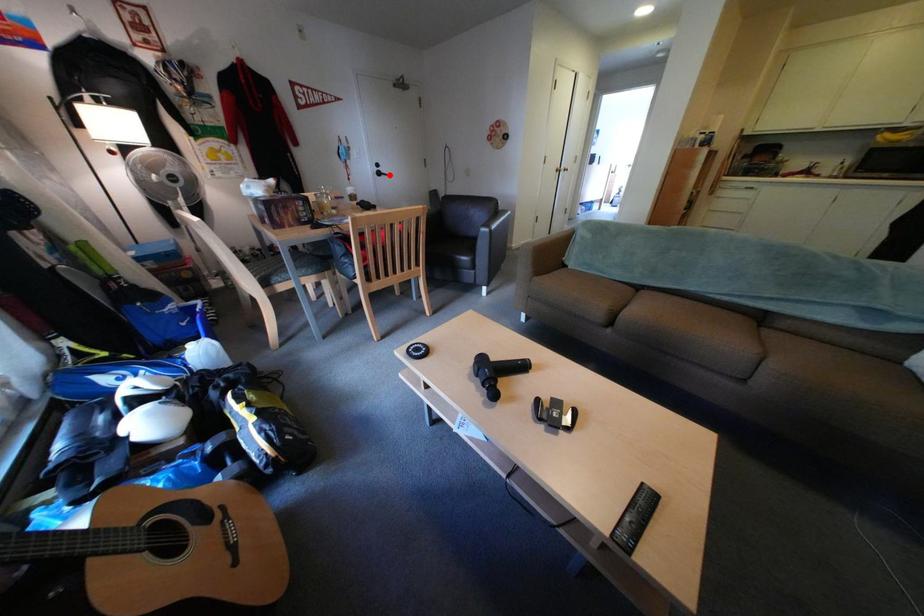
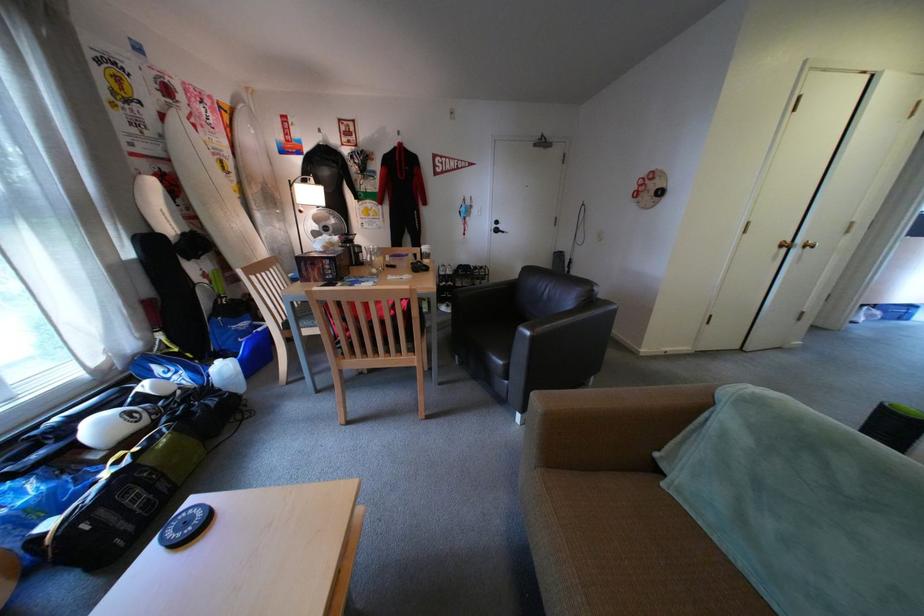
Locate, in the second image, the point that corresponds to the highlighted location in the first image.

(506, 232)